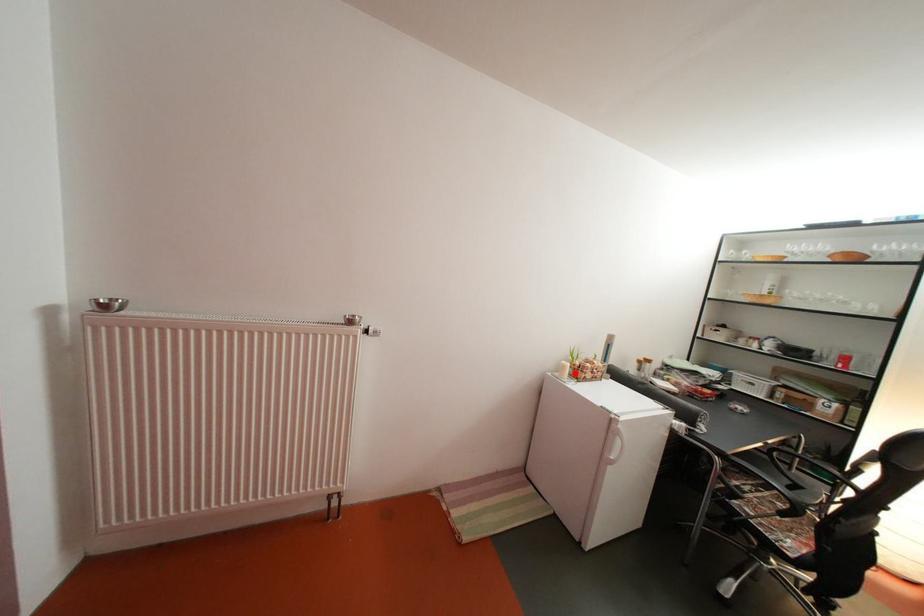
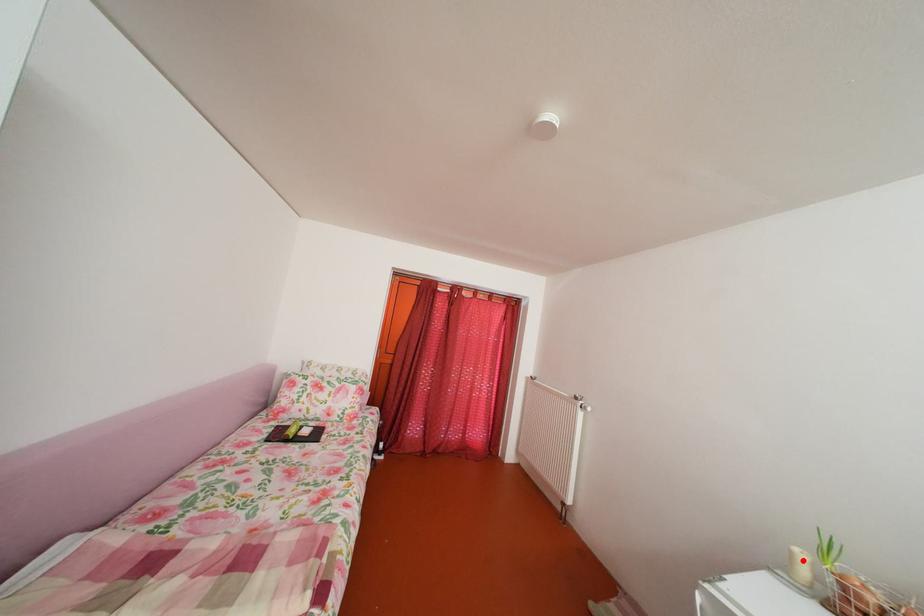
I am providing you with two images of the same scene from different viewpoints. A red point is marked on the first image and another point is marked on the second image. Is the marked point in image1 the same physical position as the marked point in image2?

Yes